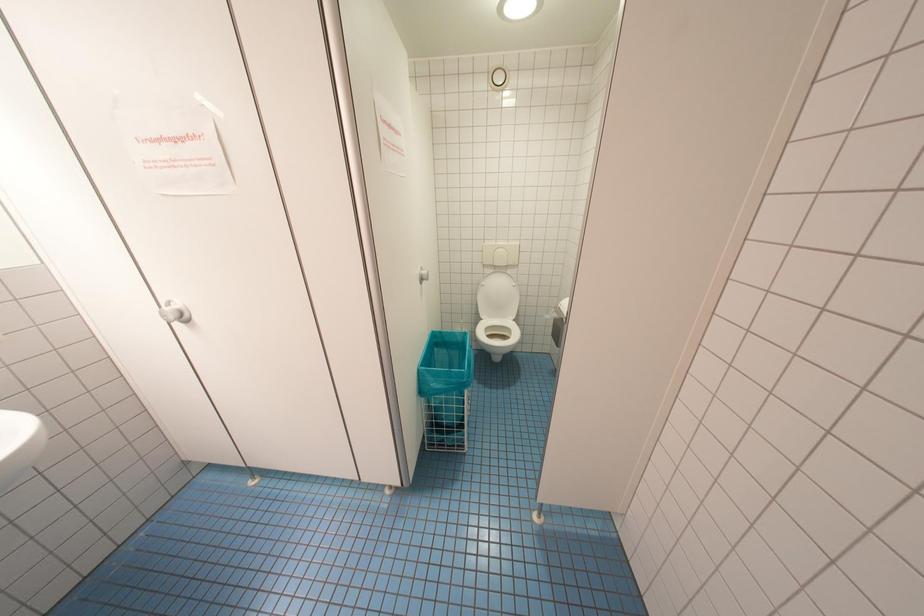
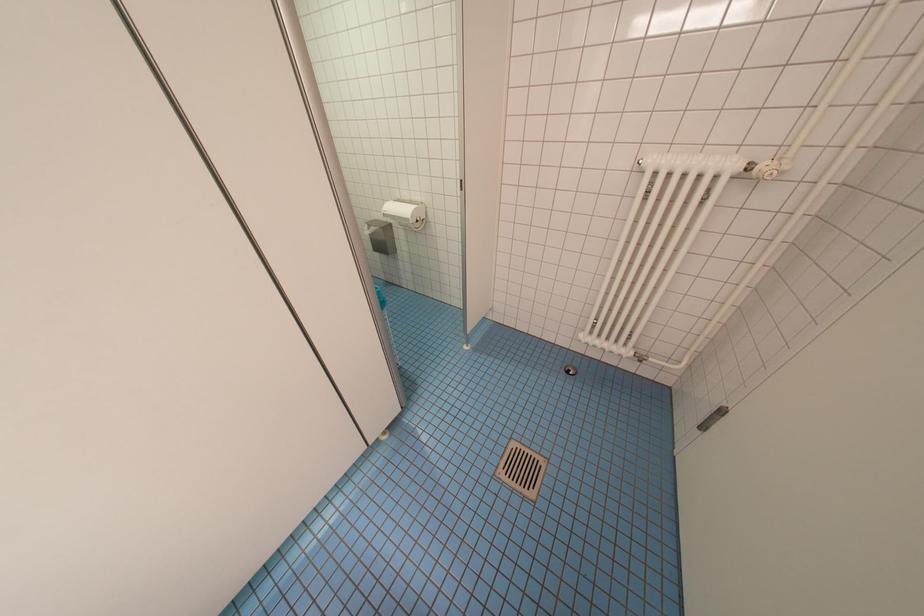
Based on the continuous images, in which direction is the camera rotating?

The camera rotated toward right-down.